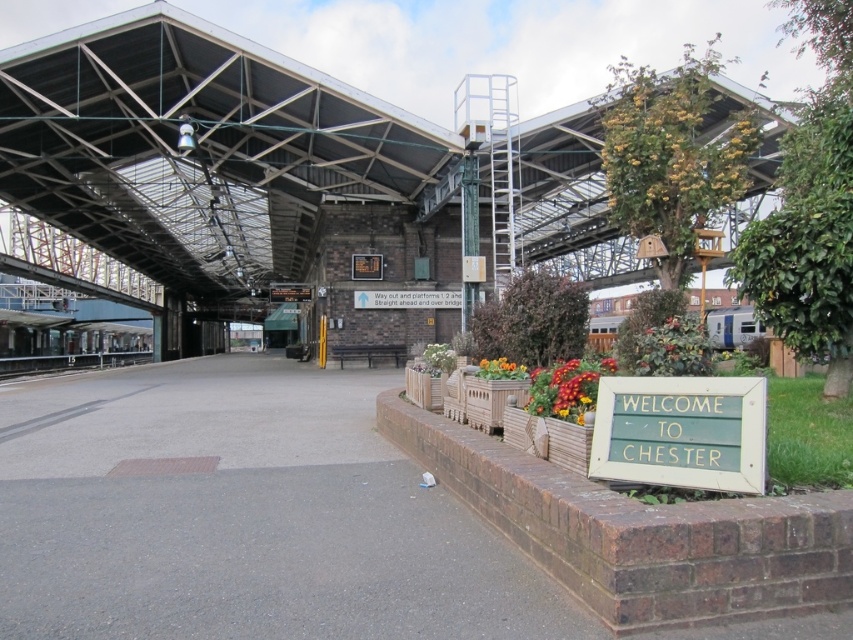
You are a maintenance worker at the station and need to place a new 100 feet long safety barrier between the green wooden sign at lower right and the black metal train track at left. Is there enough space to place it without bending the barrier?

The distance between the green wooden sign at lower right and the black metal train track at left is 136.83 feet, which is greater than the 100 feet length of the safety barrier. Therefore, there is sufficient space to place the barrier straight without bending it.

You are standing on the platform at the railway station and see the green wooden sign at lower right and the black metal train track at left. Which object is closer to you?

The green wooden sign at lower right is closer to you because it is in front of the black metal train track at left.

You are standing on the platform at the railway station and want to take a photo of both the point at coordinates (677, 445) and the point at (132, 356). Which point should you focus on first to ensure both are in clear view?

You should focus on the point at coordinates (677, 445) first because it is closer to the camera than the point at (132, 356). This way, both points will be in clear view as the camera adjusts the focus for the closer point first.